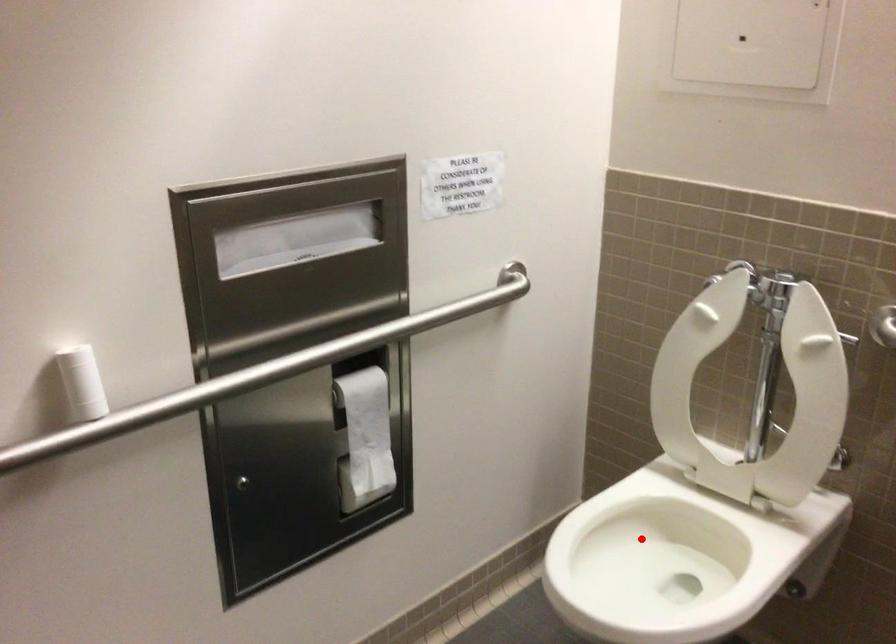
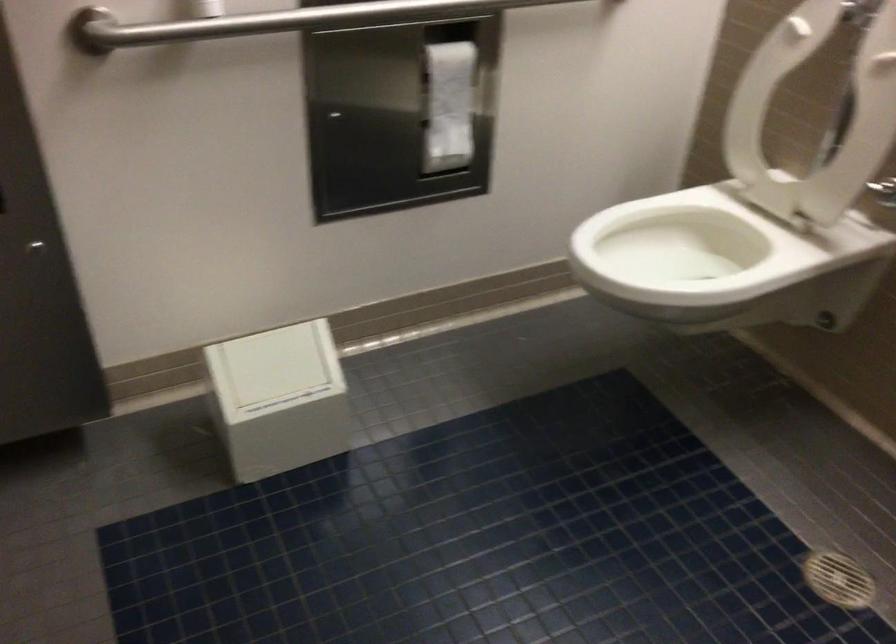
The point at the highlighted location is marked in the first image. Where is the corresponding point in the second image?

(684, 245)